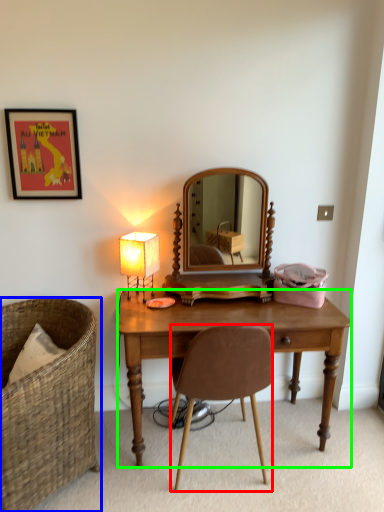
Question: Considering the real-world distances, which object is closest to chair (highlighted by a red box)? chair (highlighted by a blue box) or desk (highlighted by a green box).

Choices:
 (A) chair
 (B) desk

Answer: (B)